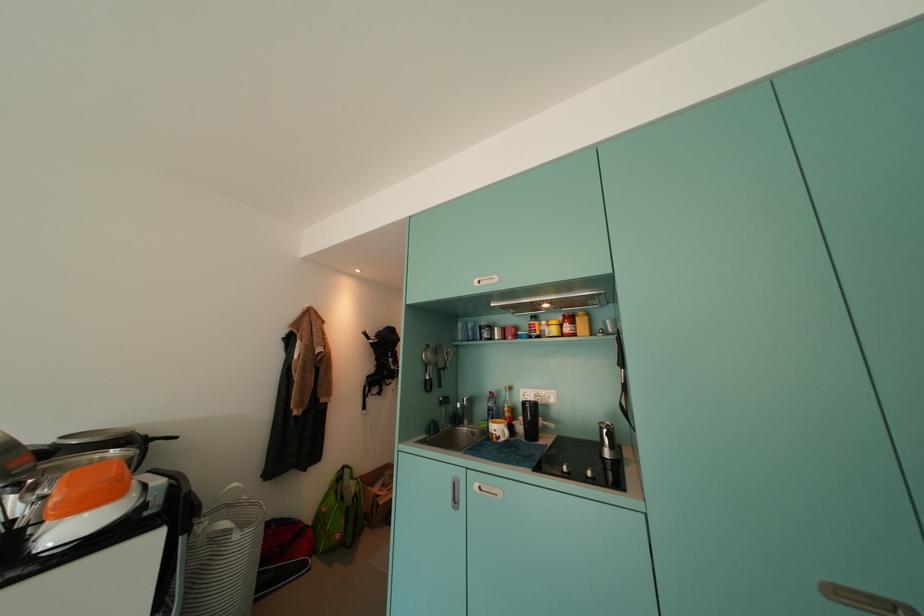
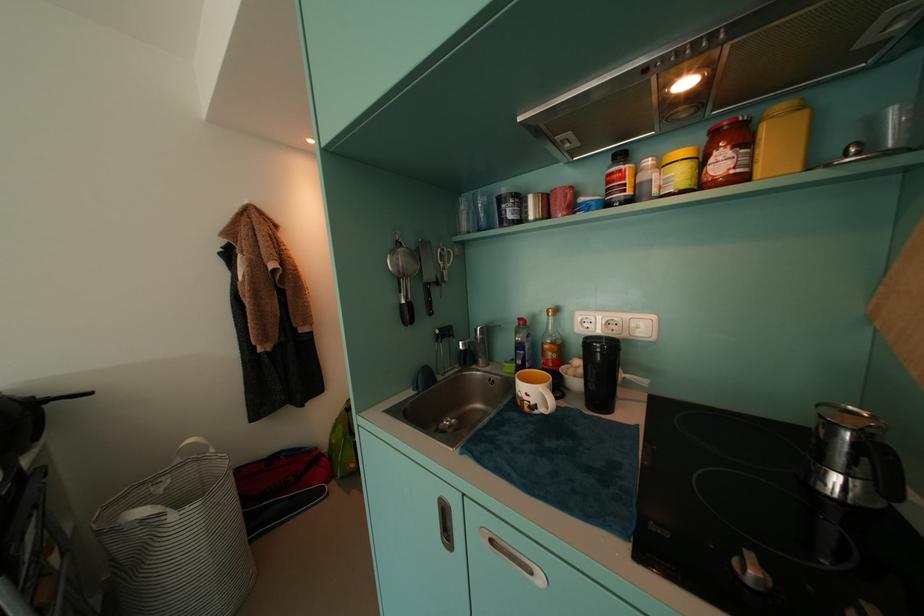
In the second image, find the point that corresponds to the point at 609,432 in the first image.

(837, 429)